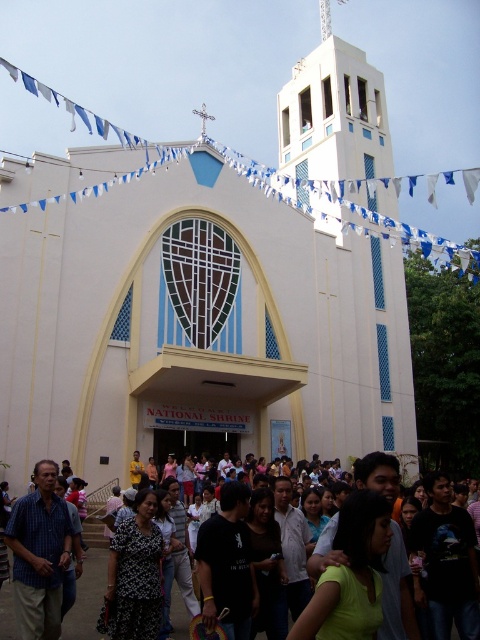
Question: Which point is closer to the camera?

Choices:
 (A) light green shirt at center
 (B) white smooth church at center

Answer: (A)

Question: Which point is farther to the camera?

Choices:
 (A) (252, 214)
 (B) (321, 552)

Answer: (A)

Question: Can you confirm if white smooth church at center is bigger than light green shirt at center?

Choices:
 (A) yes
 (B) no

Answer: (A)

Question: Is white smooth church at center to the left of light green shirt at center from the viewer's perspective?

Choices:
 (A) no
 (B) yes

Answer: (B)

Question: Which object is closer to the camera taking this photo?

Choices:
 (A) light green shirt at center
 (B) white smooth church at center

Answer: (A)

Question: Is white smooth church at center further to the viewer compared to light green shirt at center?

Choices:
 (A) yes
 (B) no

Answer: (A)